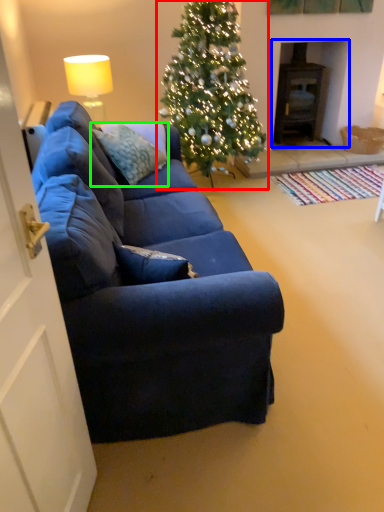
Question: Estimate the real-world distances between objects in this image. Which object is closer to christmas tree (highlighted by a red box), fireplace (highlighted by a blue box) or pillow (highlighted by a green box)?

Choices:
 (A) fireplace
 (B) pillow

Answer: (B)